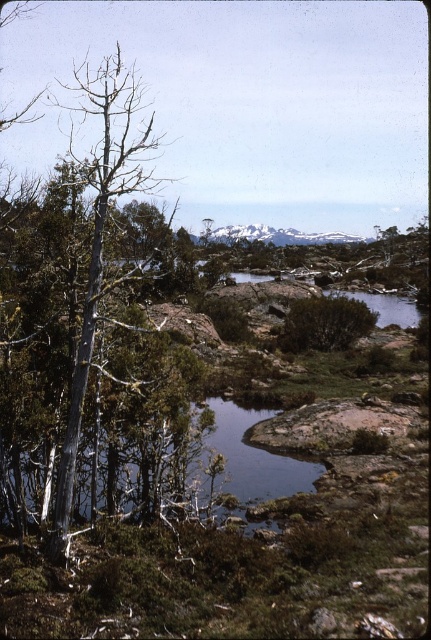
You are an explorer trying to navigate through this rocky terrain. You need to find a spot where you can set up a tent. Which object, the silver bark tree at left or the snowy rock at center, would provide more shade given their sizes?

The silver bark tree at left is larger than the snowy rock at center, so it would provide more shade for setting up the tent.

You are standing in the middle of the rocky terrain and see the green leafy bush at center and the snowy rock at center. Which object is positioned to the left when facing the scene?

The green leafy bush at center is positioned to the left of the snowy rock at center.